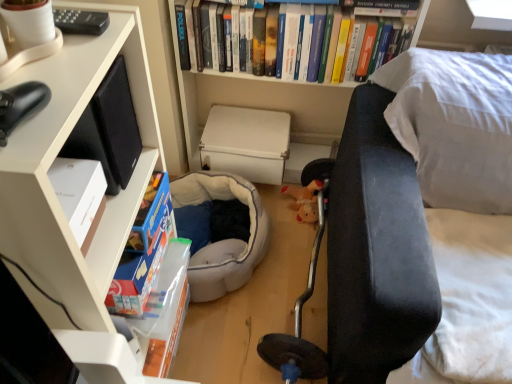
Question: Is white matte box at center surrounding soft gray fabric bean bag at center?

Choices:
 (A) no
 (B) yes

Answer: (A)

Question: Does white matte box at center touch soft gray fabric bean bag at center?

Choices:
 (A) yes
 (B) no

Answer: (B)

Question: Is white matte box at center wider than soft gray fabric bean bag at center?

Choices:
 (A) no
 (B) yes

Answer: (A)

Question: Considering the relative positions of white matte box at center and soft gray fabric bean bag at center in the image provided, is white matte box at center behind soft gray fabric bean bag at center?

Choices:
 (A) no
 (B) yes

Answer: (B)

Question: From a real-world perspective, is white matte box at center positioned under soft gray fabric bean bag at center based on gravity?

Choices:
 (A) yes
 (B) no

Answer: (B)

Question: From a real-world perspective, relative to velvet dark blue couch at right, is hardcover books at upper center vertically above or below?

Choices:
 (A) above
 (B) below

Answer: (A)

Question: In terms of width, does hardcover books at upper center look wider or thinner when compared to velvet dark blue couch at right?

Choices:
 (A) thin
 (B) wide

Answer: (A)

Question: Based on their sizes in the image, would you say hardcover books at upper center is bigger or smaller than velvet dark blue couch at right?

Choices:
 (A) small
 (B) big

Answer: (A)

Question: From their relative heights in the image, would you say hardcover books at upper center is taller or shorter than velvet dark blue couch at right?

Choices:
 (A) tall
 (B) short

Answer: (B)

Question: Considering the positions of white matte box at center and soft gray fabric bean bag at center in the image, is white matte box at center taller or shorter than soft gray fabric bean bag at center?

Choices:
 (A) tall
 (B) short

Answer: (B)

Question: Does point (244, 119) appear closer or farther from the camera than point (250, 208)?

Choices:
 (A) farther
 (B) closer

Answer: (A)

Question: Is white matte box at center wider or thinner than soft gray fabric bean bag at center?

Choices:
 (A) thin
 (B) wide

Answer: (A)

Question: Based on their sizes in the image, would you say white matte box at center is bigger or smaller than soft gray fabric bean bag at center?

Choices:
 (A) big
 (B) small

Answer: (B)

Question: Is soft gray fabric bean bag at center situated inside white matte box at center or outside?

Choices:
 (A) outside
 (B) inside

Answer: (A)

Question: From a real-world perspective, relative to white matte box at center, is soft gray fabric bean bag at center vertically above or below?

Choices:
 (A) above
 (B) below

Answer: (B)